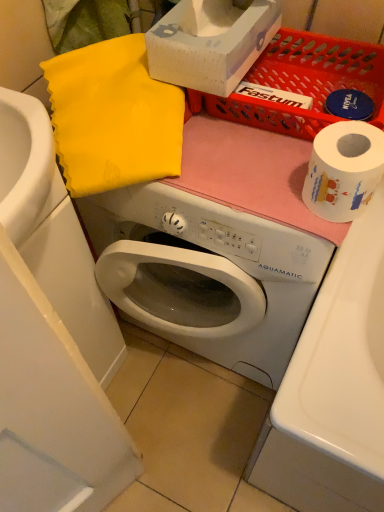
What do you see at coordinates (211, 42) in the screenshot? This screenshot has height=512, width=384. I see `white cardboard box at upper center` at bounding box center [211, 42].

Find the location of a particular element. Image resolution: width=384 pixels, height=512 pixels. white paper at right is located at coordinates (344, 170).

From a real-world perspective, which object stands above the other?

white paper at right.

From the image's perspective, which object appears higher, white paper at right or white glossy sink at lower left?

From the image's view, white paper at right is above.

Which is closer, [349,128] or [66,244]?

The point [349,128] is in front.

Considering the relative positions of white paper at right and white glossy sink at lower left in the image provided, is white paper at right to the right of white glossy sink at lower left from the viewer's perspective?

Indeed, white paper at right is positioned on the right side of white glossy sink at lower left.

Is white glossy sink at lower left spatially inside white paper at right, or outside of it?

white glossy sink at lower left is located beyond the bounds of white paper at right.

Where is `sink behind the white paper at right`? sink behind the white paper at right is located at coordinates (53, 233).

Is there a large distance between white glossy sink at lower left and white paper at right?

They are positioned close to each other.

Between white glossy sink at lower left and white paper at right, which one has more height?

Standing taller between the two is white glossy sink at lower left.

Would you say white glossy sink at lower left is to the left or to the right of white cardboard box at upper center in the picture?

Clearly, white glossy sink at lower left is on the left of white cardboard box at upper center in the image.

Is white glossy sink at lower left turned away from white cardboard box at upper center?

That's not correct — white glossy sink at lower left is not looking away from white cardboard box at upper center.

Considering the points (42, 231) and (173, 84), which point is behind, point (42, 231) or point (173, 84)?

The point (173, 84) is behind.

Are white glossy sink at lower left and white cardboard box at upper center making contact?

No, white glossy sink at lower left is not making contact with white cardboard box at upper center.

Is white paper at right positioned with its back to white cardboard box at upper center?

white paper at right does not have its back to white cardboard box at upper center.

Which object is positioned more to the left, white paper at right or white cardboard box at upper center?

Positioned to the left is white cardboard box at upper center.

Is white paper at right positioned beyond the bounds of white cardboard box at upper center?

white paper at right is positioned outside white cardboard box at upper center.

Is point (350, 187) closer to viewer compared to point (226, 88)?

Yes, point (350, 187) is in front of point (226, 88).

Who is more distant, white cardboard box at upper center or white paper at right?

Positioned behind is white cardboard box at upper center.

Looking at this image, is white cardboard box at upper center at the right side of white paper at right?

No.

From the image's perspective, is white cardboard box at upper center located above white paper at right?

Yes.

How far apart are white cardboard box at upper center and white glossy sink at lower left?

They are 37.77 centimeters apart.

Can we say white cardboard box at upper center lies outside white glossy sink at lower left?

Indeed, white cardboard box at upper center is completely outside white glossy sink at lower left.

Consider the image. How different are the orientations of white cardboard box at upper center and white glossy sink at lower left in degrees?

The angular difference between white cardboard box at upper center and white glossy sink at lower left is 87.1 degrees.

Which is more to the left, white cardboard box at upper center or white glossy sink at lower left?

white glossy sink at lower left is more to the left.

The image size is (384, 512). What are the coordinates of `toilet paper that appears on the right of white glossy sink at lower left` in the screenshot? It's located at (344, 170).

In the image, there is a white paper at right. Where is `sink below it (from a real-world perspective)`? The width and height of the screenshot is (384, 512). sink below it (from a real-world perspective) is located at coordinates (53, 233).

In the scene shown: Considering their positions, is white cardboard box at upper center positioned further to white glossy sink at lower left than white paper at right?

Among the two, white paper at right is located further to white glossy sink at lower left.

When comparing their distances from white cardboard box at upper center, does white paper at right or white glossy sink at lower left seem closer?

white paper at right lies closer to white cardboard box at upper center than the other object.

Considering their positions, is white paper at right positioned further to white glossy sink at lower left than white cardboard box at upper center?

Based on the image, white paper at right appears to be further to white glossy sink at lower left.

In the scene shown: Estimate the real-world distances between objects in this image. Which object is closer to white cardboard box at upper center, white glossy sink at lower left or white paper at right?

white paper at right lies closer to white cardboard box at upper center than the other object.

Estimate the real-world distances between objects in this image. Which object is further from white paper at right, white glossy sink at lower left or white cardboard box at upper center?

The object further to white paper at right is white glossy sink at lower left.

Based on their spatial positions, is white cardboard box at upper center or white glossy sink at lower left further from white paper at right?

white glossy sink at lower left.

Locate an element on the screen. The width and height of the screenshot is (384, 512). box between white glossy sink at lower left and white paper at right in the horizontal direction is located at coordinates (211, 42).